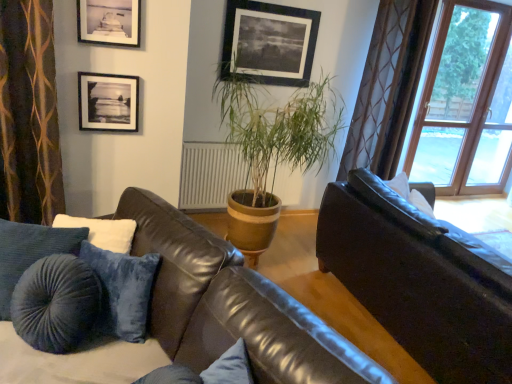
Question: Should I look upward or downward to see leather couch at center, the first studio couch positioned from the left?

Choices:
 (A) up
 (B) down

Answer: (B)

Question: Should I look upward or downward to see green leafy plant at center?

Choices:
 (A) up
 (B) down

Answer: (A)

Question: Considering the relative sizes of shiny brown leather couch at right, the 2th studio couch positioned from the left, and black matte picture frame at upper left, the third picture frame positioned from the right, in the image provided, is shiny brown leather couch at right, the 2th studio couch positioned from the left, taller than black matte picture frame at upper left, the third picture frame positioned from the right,?

Choices:
 (A) yes
 (B) no

Answer: (A)

Question: Considering the relative sizes of shiny brown leather couch at right, the 1th studio couch positioned from the right, and black matte picture frame at upper left, which is the first picture frame from left to right, in the image provided, is shiny brown leather couch at right, the 1th studio couch positioned from the right, thinner than black matte picture frame at upper left, which is the first picture frame from left to right,?

Choices:
 (A) yes
 (B) no

Answer: (B)

Question: Does shiny brown leather couch at right, the 2th studio couch positioned from the left, appear on the left side of black matte picture frame at upper left, which is the first picture frame from left to right?

Choices:
 (A) no
 (B) yes

Answer: (A)

Question: Considering the relative positions of shiny brown leather couch at right, the 1th studio couch positioned from the right, and black matte picture frame at upper left, placed as the 3th picture frame when sorted from top to bottom, in the image provided, is shiny brown leather couch at right, the 1th studio couch positioned from the right, behind black matte picture frame at upper left, placed as the 3th picture frame when sorted from top to bottom,?

Choices:
 (A) yes
 (B) no

Answer: (B)

Question: Is shiny brown leather couch at right, the 1th studio couch positioned from the right, outside of black matte picture frame at upper left, which is the first picture frame from left to right?

Choices:
 (A) no
 (B) yes

Answer: (B)

Question: Is shiny brown leather couch at right, the 1th studio couch positioned from the right, shorter than black matte picture frame at upper left, positioned as the 2th picture frame in front-to-back order?

Choices:
 (A) yes
 (B) no

Answer: (B)

Question: Does brown textured curtain at left appear on the right side of green leafy plant at center?

Choices:
 (A) no
 (B) yes

Answer: (A)

Question: Does brown textured curtain at left have a lesser height compared to green leafy plant at center?

Choices:
 (A) yes
 (B) no

Answer: (A)

Question: Is brown textured curtain at left thinner than green leafy plant at center?

Choices:
 (A) no
 (B) yes

Answer: (B)

Question: Is brown textured curtain at left directly adjacent to green leafy plant at center?

Choices:
 (A) yes
 (B) no

Answer: (B)

Question: From a real-world perspective, is brown textured curtain at left positioned over green leafy plant at center based on gravity?

Choices:
 (A) no
 (B) yes

Answer: (B)

Question: Is brown textured curtain at left far from green leafy plant at center?

Choices:
 (A) no
 (B) yes

Answer: (B)

Question: Is leather couch at center, the first studio couch positioned from the left, surrounding brown textured curtain at left?

Choices:
 (A) yes
 (B) no

Answer: (B)